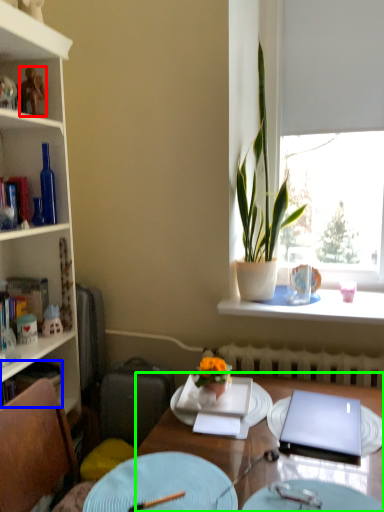
Question: Based on their relative distances, which object is farther from toy (highlighted by a red box)? Choose from book (highlighted by a blue box) and desk (highlighted by a green box).

Choices:
 (A) book
 (B) desk

Answer: (B)